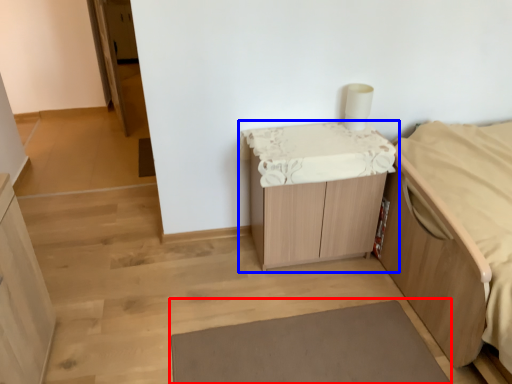
Question: Among these objects, which one is nearest to the camera, bath mat (highlighted by a red box) or table (highlighted by a blue box)?

Choices:
 (A) bath mat
 (B) table

Answer: (A)